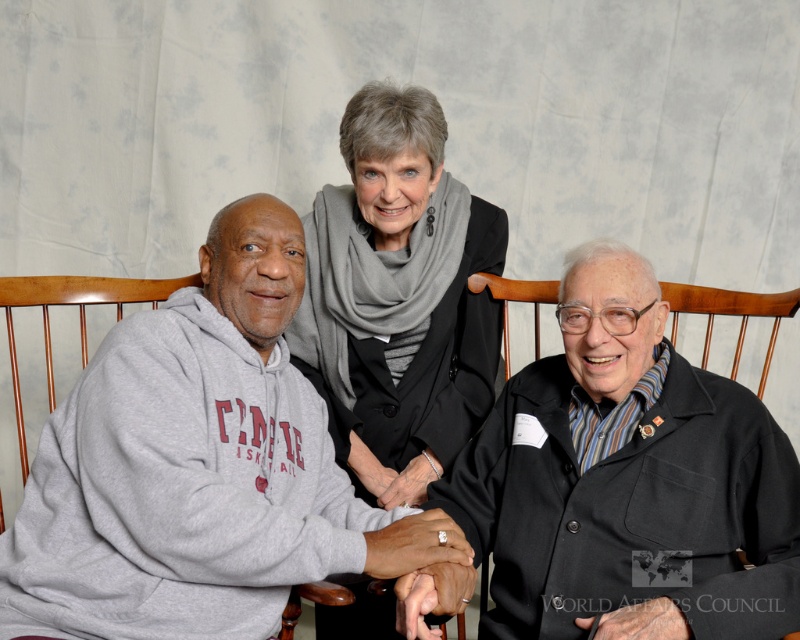
Question: Which point is closer to the camera taking this photo?

Choices:
 (A) (232, 380)
 (B) (740, 600)

Answer: (B)

Question: Considering the relative positions of gray hoodie at left and gray wool scarf at center in the image provided, where is gray hoodie at left located with respect to gray wool scarf at center?

Choices:
 (A) above
 (B) below

Answer: (B)

Question: Can you confirm if gray hoodie at left is positioned below black wool coat at right?

Choices:
 (A) no
 (B) yes

Answer: (B)

Question: Which is nearer to the black wool coat at right?

Choices:
 (A) gray hoodie at left
 (B) gray wool scarf at center

Answer: (A)

Question: Can you confirm if gray hoodie at left is bigger than black wool coat at right?

Choices:
 (A) no
 (B) yes

Answer: (B)

Question: Among these points, which one is farthest from the camera?

Choices:
 (A) (421, 548)
 (B) (720, 500)
 (C) (364, 486)

Answer: (C)